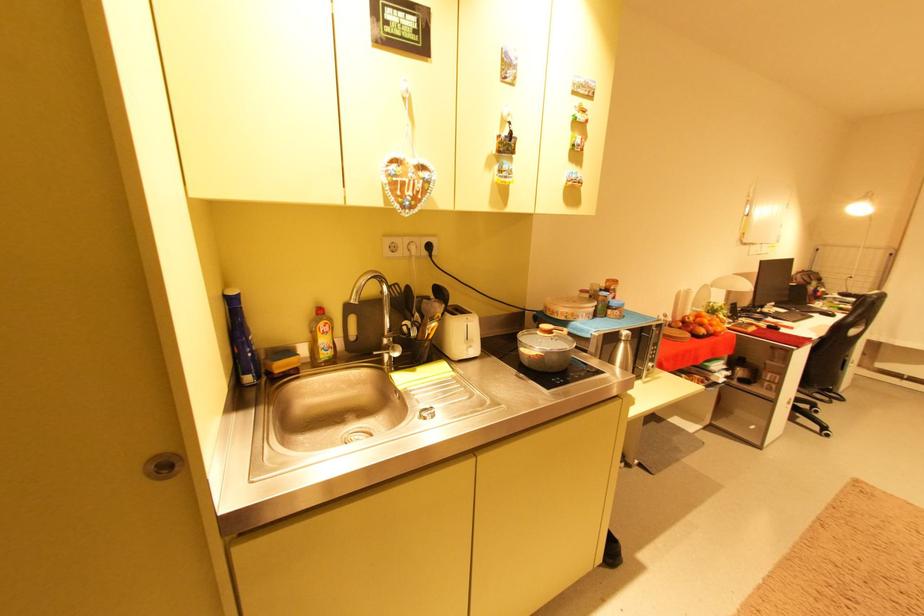
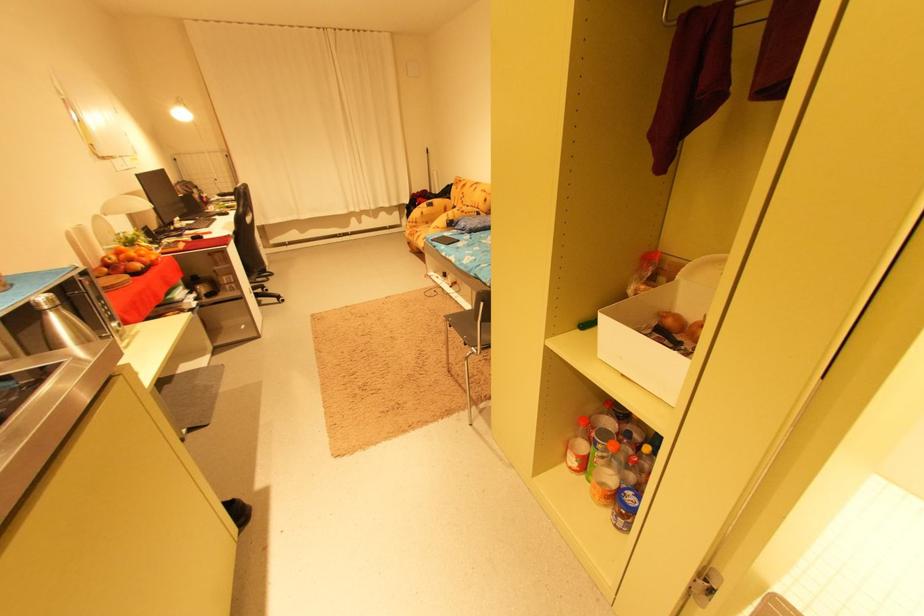
Find the pixel in the second image that matches the point at 830,339 in the first image.

(242, 233)